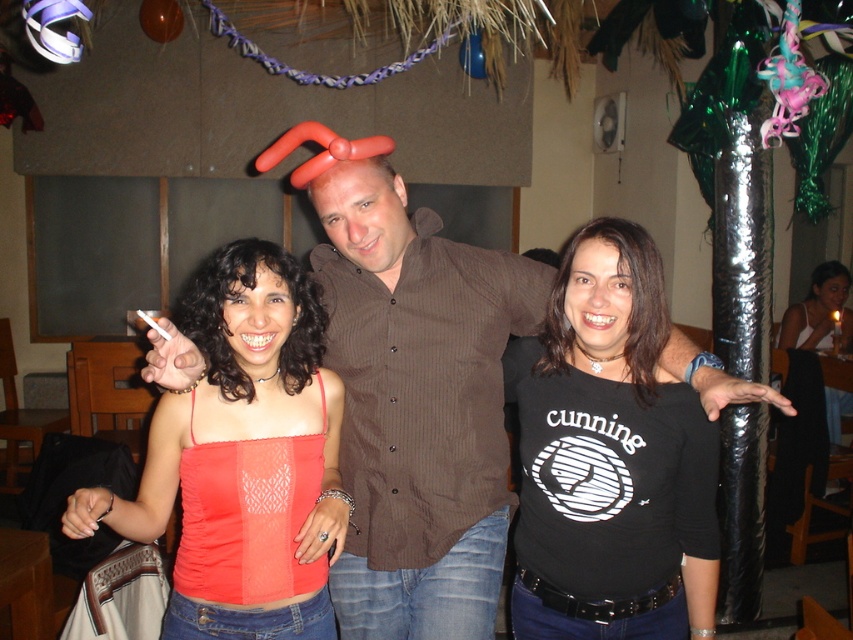
Question: Which point is farther from the camera taking this photo?

Choices:
 (A) (827, 321)
 (B) (367, 168)
 (C) (161, 470)
 (D) (595, 253)

Answer: (A)

Question: Which of these objects is positioned closest to the black matte shirt at center?

Choices:
 (A) black matte tank top at center
 (B) brown textured shirt at center
 (C) orange sheer top at center

Answer: (B)

Question: Can you confirm if black matte shirt at center is positioned to the right of black matte tank top at center?

Choices:
 (A) yes
 (B) no

Answer: (B)

Question: Which point is farther from the camera taking this photo?

Choices:
 (A) (526, 573)
 (B) (181, 614)
 (C) (360, 508)

Answer: (C)

Question: Observing the image, what is the correct spatial positioning of orange sheer top at center in reference to brown textured shirt at center?

Choices:
 (A) below
 (B) above

Answer: (A)

Question: Does orange sheer top at center appear on the right side of brown textured shirt at center?

Choices:
 (A) no
 (B) yes

Answer: (A)